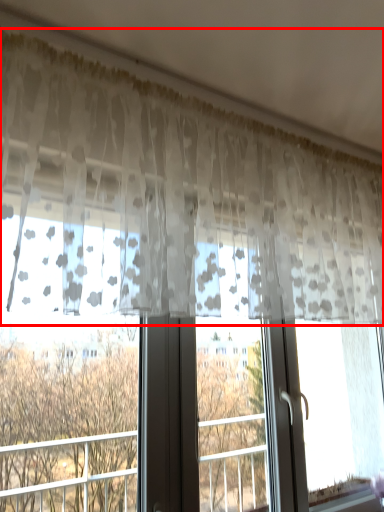
Question: Observing the image, what is the correct spatial positioning of curtain (annotated by the red box) in reference to tree?

Choices:
 (A) right
 (B) left

Answer: (A)